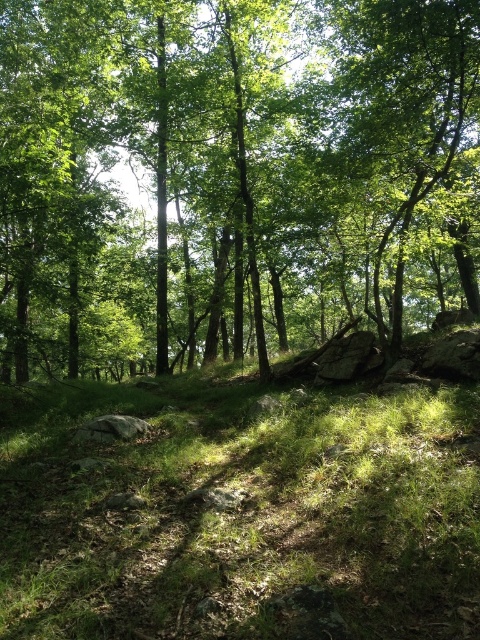
Question: Can you confirm if green leafy tree at center is positioned to the right of green grass at center?

Choices:
 (A) no
 (B) yes

Answer: (B)

Question: Which point is farther from the camera taking this photo?

Choices:
 (A) (316, 529)
 (B) (46, 112)

Answer: (B)

Question: Which point is closer to the camera?

Choices:
 (A) (333, 529)
 (B) (44, 132)

Answer: (A)

Question: Is green leafy tree at center to the left of green grass at center from the viewer's perspective?

Choices:
 (A) no
 (B) yes

Answer: (A)

Question: Is green leafy tree at center wider than green grass at center?

Choices:
 (A) no
 (B) yes

Answer: (B)